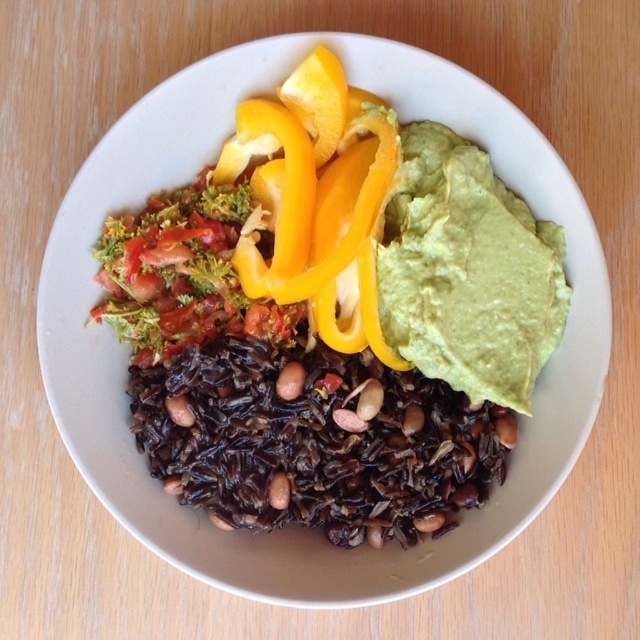
Question: Is green creamy guacamole at upper right positioned at the back of brown matte bean at center?

Choices:
 (A) no
 (B) yes

Answer: (A)

Question: Is green creamy guacamole at upper right thinner than brown matte bean at center?

Choices:
 (A) no
 (B) yes

Answer: (A)

Question: Which point is closer to the camera?

Choices:
 (A) (460, 333)
 (B) (288, 388)

Answer: (A)

Question: Which of the following is the closest to the observer?

Choices:
 (A) (480, 278)
 (B) (360, 225)
 (C) (301, 371)

Answer: (A)

Question: Among these objects, which one is farthest from the camera?

Choices:
 (A) green creamy guacamole at upper right
 (B) brown matte bean at center

Answer: (B)

Question: Is green creamy guacamole at upper right further to the viewer compared to brown matte bean at center?

Choices:
 (A) yes
 (B) no

Answer: (B)